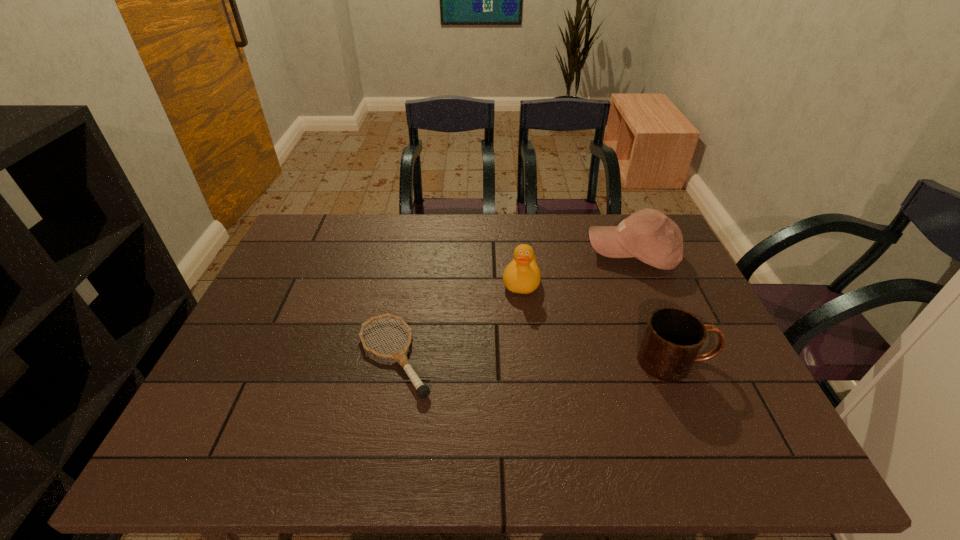
The image size is (960, 540). I want to click on vacant point located on the face of the duck, so point(512,341).

Find the location of a particular element. The image size is (960, 540). free space located 0.210m on the face of the duck is located at coordinates (509, 356).

Find the location of a particular element. The height and width of the screenshot is (540, 960). object located at the far edge is located at coordinates (648, 235).

What are the coordinates of `object that is at the near edge` in the screenshot? It's located at (400, 356).

Locate an element on the screen. The height and width of the screenshot is (540, 960). mug that is at the right edge is located at coordinates (673, 337).

Identify the location of baseball cap located at the right edge. (648, 235).

The width and height of the screenshot is (960, 540). Identify the location of object present at the far right corner. coord(648,235).

Locate an element on the screen. free space at the far edge of the desktop is located at coordinates (353, 256).

In the image, there is a desktop. Where is `vacant space at the near edge`? This screenshot has height=540, width=960. vacant space at the near edge is located at coordinates (530, 421).

Identify the location of free space at the left edge of the desktop. The image size is (960, 540). (309, 259).